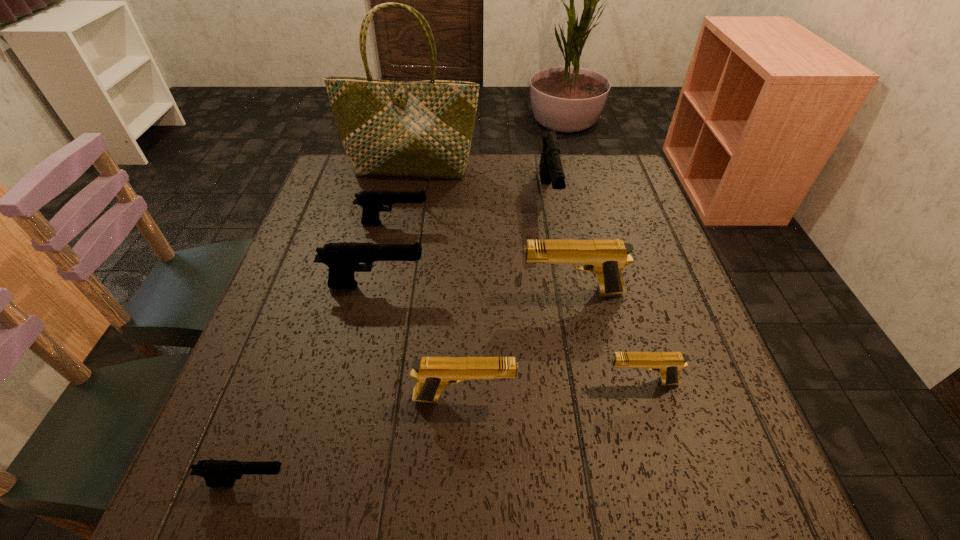
Locate an element on the screen. free area in between the biggest black pistol and the shopping bag is located at coordinates (480, 183).

What are the coordinates of `free point between the smallest black pistol and the third farthest black pistol` in the screenshot? It's located at (312, 384).

Locate an element on the screen. This screenshot has height=540, width=960. free spot between the nearest black pistol and the second smallest black pistol is located at coordinates (322, 353).

Locate an element on the screen. The width and height of the screenshot is (960, 540). free space that is in between the biggest tan pistol and the second biggest black pistol is located at coordinates (473, 289).

Where is `blank region between the leftmost tan pistol and the tallest object`? The width and height of the screenshot is (960, 540). blank region between the leftmost tan pistol and the tallest object is located at coordinates (438, 284).

In order to click on vacant point located between the third nearest object and the third farthest black pistol in this screenshot , I will do `click(508, 334)`.

Image resolution: width=960 pixels, height=540 pixels. I want to click on object that is the third closest to the biggest tan pistol, so click(x=551, y=171).

Locate which object is the second closest to the rightmost black pistol. Please provide its 2D coordinates. Your answer should be formatted as a tuple, i.e. [(x, y)], where the tuple contains the x and y coordinates of a point satisfying the conditions above.

[(605, 258)]

Identify the location of the sixth closest pistol to the smallest black pistol. This screenshot has height=540, width=960. (551, 171).

This screenshot has height=540, width=960. Identify the location of pistol that stands as the fourth closest to the second smallest black pistol. coord(433,374).